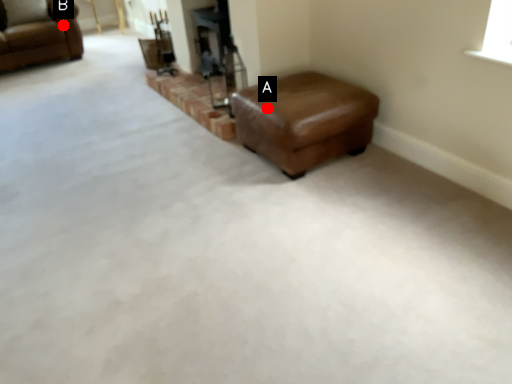
Question: Two points are circled on the image, labeled by A and B beside each circle. Among these points, which one is farthest from the camera?

Choices:
 (A) A is further
 (B) B is further

Answer: (B)